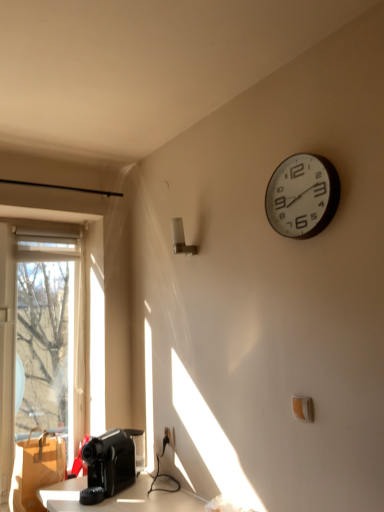
You are a GUI agent. You are given a task and a screenshot of the screen. Output one action in this format:
    pyautogui.click(x=<x>, y=<y>)
    Task: Click on the brown cardboard box at lower left
    The height and width of the screenshot is (512, 384).
    Given the screenshot: What is the action you would take?
    click(x=36, y=470)

From a real-world perspective, is black plastic coffee machine at lower left physically located above or below white plastic wall clock at upper right?

black plastic coffee machine at lower left is situated lower than white plastic wall clock at upper right in the real world.

In the scene shown: Is black plastic coffee machine at lower left turned away from white plastic wall clock at upper right?

black plastic coffee machine at lower left is not turned away from white plastic wall clock at upper right.

How different are the orientations of black plastic coffee machine at lower left and white plastic wall clock at upper right in degrees?

They differ by 24.9 degrees in their facing directions.

Looking at their sizes, would you say black plastic coffee machine at lower left is wider or thinner than white plastic wall clock at upper right?

In the image, black plastic coffee machine at lower left appears to be wider than white plastic wall clock at upper right.

Can you confirm if white plastic wall clock at upper right is wider than black plastic coffee machine at lower left?

Incorrect, the width of white plastic wall clock at upper right does not surpass that of black plastic coffee machine at lower left.

Is white plastic wall clock at upper right positioned beyond the bounds of black plastic coffee machine at lower left?

white plastic wall clock at upper right lies outside black plastic coffee machine at lower left's area.

From a real-world perspective, is brown cardboard box at lower left located beneath black plastic coffee machine at lower left?

Yes, from a real-world perspective, brown cardboard box at lower left is under black plastic coffee machine at lower left.

Can you confirm if brown cardboard box at lower left is thinner than black plastic coffee machine at lower left?

Indeed, brown cardboard box at lower left has a lesser width compared to black plastic coffee machine at lower left.

How different are the orientations of brown cardboard box at lower left and black plastic coffee machine at lower left in degrees?

The angle between the facing direction of brown cardboard box at lower left and the facing direction of black plastic coffee machine at lower left is 59 degrees.

Based on the photo, considering the sizes of objects brown cardboard box at lower left and black plastic coffee machine at lower left in the image provided, who is smaller, brown cardboard box at lower left or black plastic coffee machine at lower left?

With smaller size is black plastic coffee machine at lower left.

From the image's perspective, between brown cardboard box at lower left and white plastic wall clock at upper right, who is located below?

brown cardboard box at lower left appears lower in the image.

Considering the sizes of objects brown cardboard box at lower left and white plastic wall clock at upper right in the image provided, who is thinner, brown cardboard box at lower left or white plastic wall clock at upper right?

white plastic wall clock at upper right is thinner.

Which of these two, brown cardboard box at lower left or white plastic wall clock at upper right, stands shorter?

Standing shorter between the two is white plastic wall clock at upper right.

From a real-world perspective, which is physically below, brown cardboard box at lower left or white plastic wall clock at upper right?

From a 3D spatial view, brown cardboard box at lower left is below.

From the image's perspective, is black plastic coffee machine at lower left located above or below brown cardboard box at lower left?

Based on their image positions, black plastic coffee machine at lower left is located above brown cardboard box at lower left.

Is black plastic coffee machine at lower left further to camera compared to brown cardboard box at lower left?

That is False.

From a real-world perspective, does black plastic coffee machine at lower left sit lower than brown cardboard box at lower left?

Incorrect, from a real-world perspective, black plastic coffee machine at lower left is higher than brown cardboard box at lower left.

Based on their positions, is black plastic coffee machine at lower left located to the left or right of brown cardboard box at lower left?

From the image, it's evident that black plastic coffee machine at lower left is to the right of brown cardboard box at lower left.

Is white plastic wall clock at upper right surrounding brown cardboard box at lower left?

That's incorrect, brown cardboard box at lower left is not inside white plastic wall clock at upper right.

From the image's perspective, which is below, white plastic wall clock at upper right or brown cardboard box at lower left?

brown cardboard box at lower left appears lower in the image.

Identify the location of wall clock located above the brown cardboard box at lower left (from a real-world perspective). Image resolution: width=384 pixels, height=512 pixels. (302, 196).

How far apart are white plastic wall clock at upper right and brown cardboard box at lower left?

A distance of 5.81 feet exists between white plastic wall clock at upper right and brown cardboard box at lower left.

This screenshot has width=384, height=512. I want to click on appliance below the white plastic wall clock at upper right (from the image's perspective), so click(x=108, y=465).

Locate an element on the screen. appliance behind the white plastic wall clock at upper right is located at coordinates (108, 465).

Looking at the image, which one is located further to brown cardboard box at lower left, white plastic wall clock at upper right or black plastic coffee machine at lower left?

Based on the image, white plastic wall clock at upper right appears to be further to brown cardboard box at lower left.

Based on their spatial positions, is brown cardboard box at lower left or black plastic coffee machine at lower left closer to white plastic wall clock at upper right?

Among the two, black plastic coffee machine at lower left is located nearer to white plastic wall clock at upper right.

Looking at the image, which one is located closer to brown cardboard box at lower left, black plastic coffee machine at lower left or white plastic wall clock at upper right?

black plastic coffee machine at lower left lies closer to brown cardboard box at lower left than the other object.

Estimate the real-world distances between objects in this image. Which object is further from white plastic wall clock at upper right, black plastic coffee machine at lower left or brown cardboard box at lower left?

Among the two, brown cardboard box at lower left is located further to white plastic wall clock at upper right.

Based on the photo, looking at the image, which one is located closer to black plastic coffee machine at lower left, white plastic wall clock at upper right or brown cardboard box at lower left?

brown cardboard box at lower left.

Considering their positions, is brown cardboard box at lower left positioned further to black plastic coffee machine at lower left than white plastic wall clock at upper right?

Among the two, white plastic wall clock at upper right is located further to black plastic coffee machine at lower left.

The image size is (384, 512). In order to click on appliance between white plastic wall clock at upper right and brown cardboard box at lower left in the vertical direction in this screenshot , I will do `click(108, 465)`.